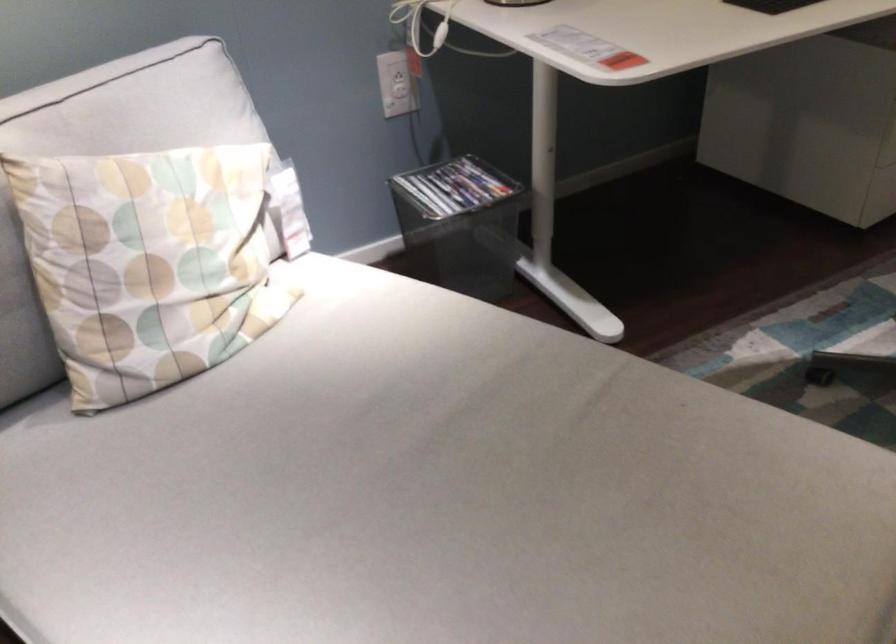
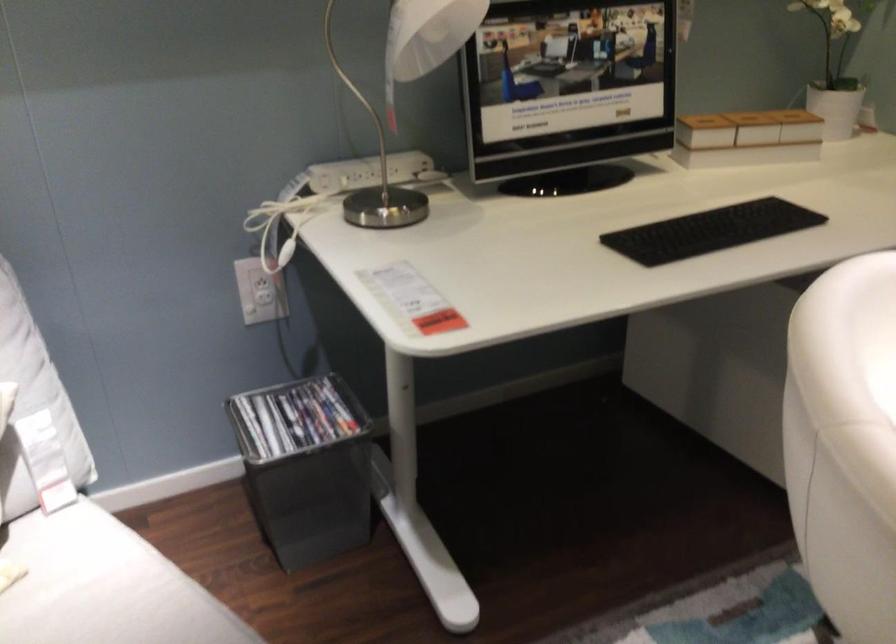
In the second image, find the point that corresponds to the point at 460,225 in the first image.

(355, 437)